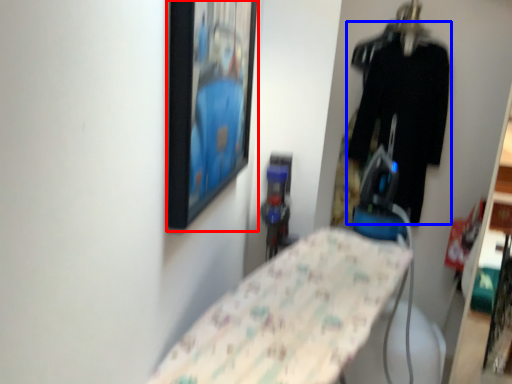
Question: Which of the following is the closest to the observer, picture frame (highlighted by a red box) or clothing (highlighted by a blue box)?

Choices:
 (A) picture frame
 (B) clothing

Answer: (A)